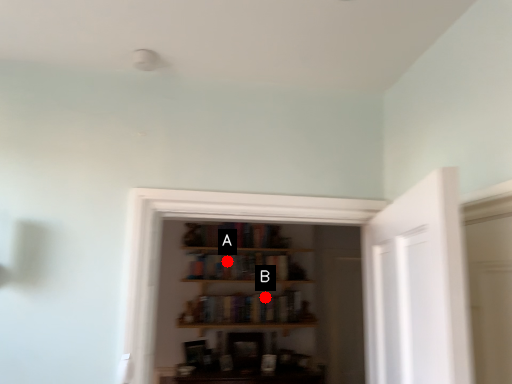
Question: Two points are circled on the image, labeled by A and B beside each circle. Which of the following is the closest to the observer?

Choices:
 (A) A is closer
 (B) B is closer

Answer: (A)